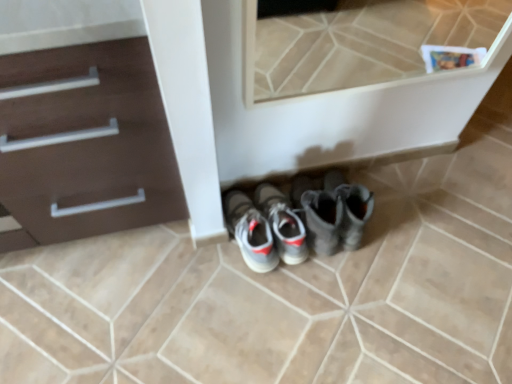
You are a GUI agent. You are given a task and a screenshot of the screen. Output one action in this format:
    pyautogui.click(x=<x>, y=<y>)
    Task: Click on the vacant point to the right of gray fabric sneakers at center
    The image size is (512, 384).
    Given the screenshot: What is the action you would take?
    pyautogui.click(x=352, y=265)